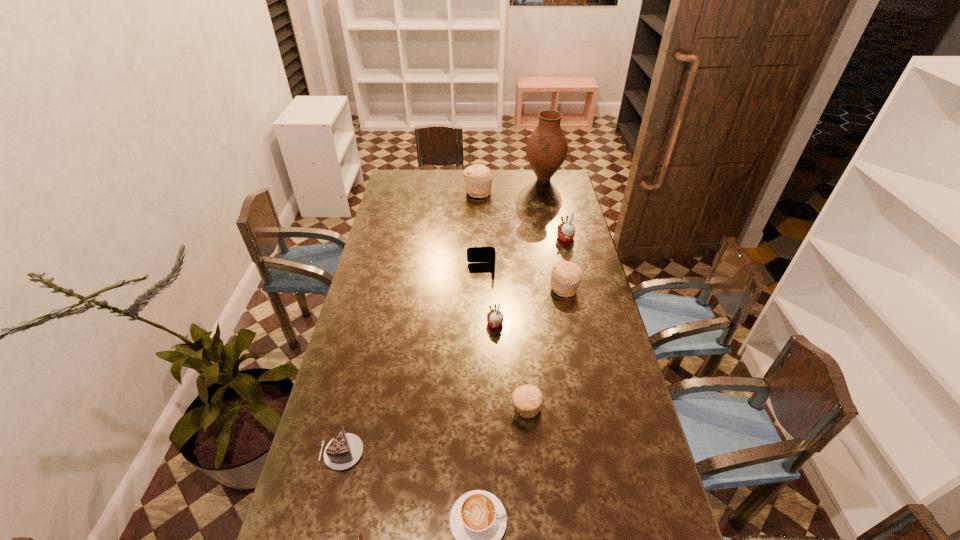
Point out which object is positioned as the third nearest to the fourth farthest muffin. Please provide its 2D coordinates. Your answer should be formatted as a tuple, i.e. [(x, y)], where the tuple contains the x and y coordinates of a point satisfying the conditions above.

[(527, 399)]

Identify which object is located as the seventh nearest to the white cappuccino. Please provide its 2D coordinates. Your answer should be formatted as a tuple, i.e. [(x, y)], where the tuple contains the x and y coordinates of a point satisfying the conditions above.

[(566, 231)]

Where is `the fourth closest muffin to the farthest beige muffin`? The height and width of the screenshot is (540, 960). the fourth closest muffin to the farthest beige muffin is located at coordinates (527, 399).

This screenshot has width=960, height=540. I want to click on muffin that is the fifth closest to the wallet, so click(x=527, y=399).

Identify which beige muffin is the closest to the shortest object. Please provide its 2D coordinates. Your answer should be formatted as a tuple, i.e. [(x, y)], where the tuple contains the x and y coordinates of a point satisfying the conditions above.

[(527, 399)]

Choose which beige muffin is the third nearest neighbor to the cappuccino. Please provide its 2D coordinates. Your answer should be formatted as a tuple, i.e. [(x, y)], where the tuple contains the x and y coordinates of a point satisfying the conditions above.

[(478, 178)]

Locate an element on the screen. free space that satisfies the following two spatial constraints: 1. on the back side of the tallest object; 2. on the right side of the farthest beige muffin is located at coordinates (478, 179).